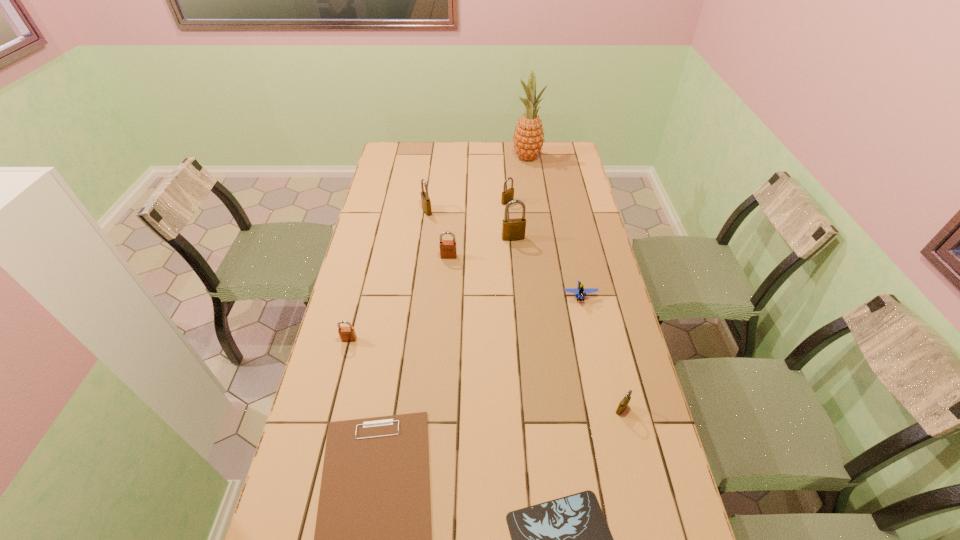
Locate an element on the screen. object that is the second nearest to the shortest object is located at coordinates (624, 402).

Select which padlock is the closest to the ninth shortest object. Please provide its 2D coordinates. Your answer should be formatted as a tuple, i.e. [(x, y)], where the tuple contains the x and y coordinates of a point satisfying the conditions above.

[(448, 250)]

Identify which padlock is the sixth closest to the Lego. Please provide its 2D coordinates. Your answer should be formatted as a tuple, i.e. [(x, y)], where the tuple contains the x and y coordinates of a point satisfying the conditions above.

[(347, 334)]

Image resolution: width=960 pixels, height=540 pixels. I want to click on brass padlock that is the second closest to the clipboard, so click(512, 229).

Where is `brass padlock that is the fourth closest to the bigger brown padlock`? The height and width of the screenshot is (540, 960). brass padlock that is the fourth closest to the bigger brown padlock is located at coordinates (624, 402).

Where is `vacant space that satisfies the following two spatial constraints: 1. on the front-facing side of the nearest padlock; 2. on the left side of the bigger brown padlock`? vacant space that satisfies the following two spatial constraints: 1. on the front-facing side of the nearest padlock; 2. on the left side of the bigger brown padlock is located at coordinates (438, 409).

Find the location of a particular element. Image resolution: width=960 pixels, height=540 pixels. free space that satisfies the following two spatial constraints: 1. on the front-facing side of the bigger brown padlock; 2. on the left side of the rightmost padlock is located at coordinates (438, 409).